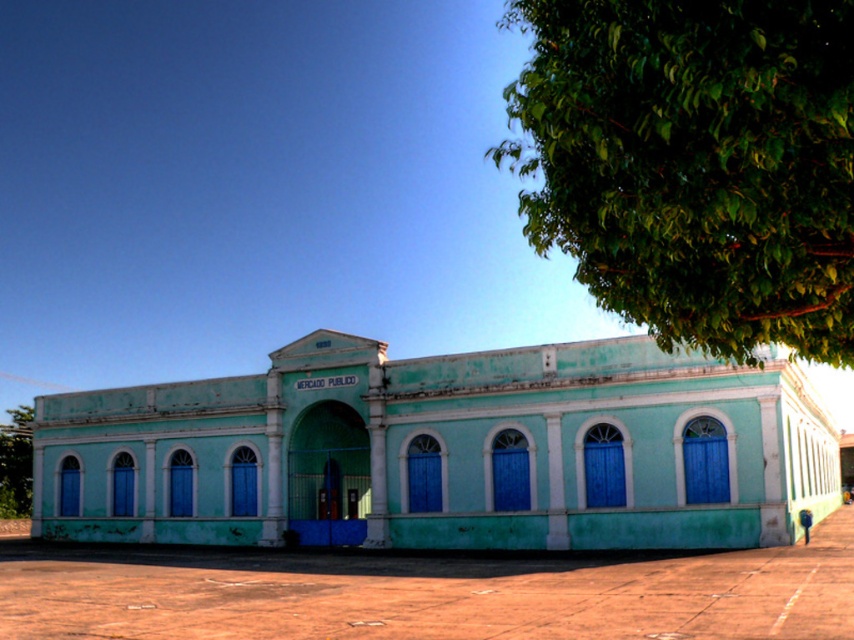
Question: From the image, what is the correct spatial relationship of green leafy tree at upper right in relation to green leafy tree at lower left?

Choices:
 (A) left
 (B) right

Answer: (B)

Question: Which point appears closest to the camera in this image?

Choices:
 (A) (642, 276)
 (B) (28, 472)

Answer: (A)

Question: Does green leafy tree at upper right appear on the left side of green leafy tree at lower left?

Choices:
 (A) yes
 (B) no

Answer: (B)

Question: Is green leafy tree at upper right below green leafy tree at lower left?

Choices:
 (A) yes
 (B) no

Answer: (B)

Question: Which point is closer to the camera?

Choices:
 (A) green leafy tree at upper right
 (B) green leafy tree at lower left

Answer: (A)